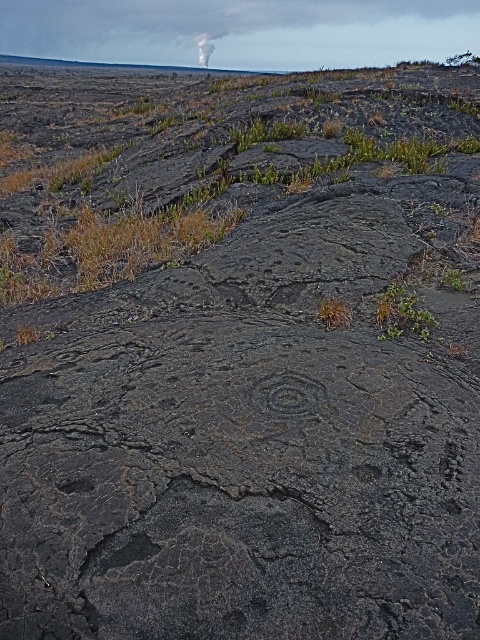
You are a botanist studying the lava field. You notice the green leafy plant at center and the white smoke at upper center. Which object is positioned to the right of the other?

The green leafy plant at center is to the right of the white smoke at upper center.

You are a botanist studying plant growth in volcanic areas. You observe the point marked at coordinates (x=402, y=314) in the image. What is the significance of this point in relation to the volcanic landscape?

The point at coordinates (x=402, y=314) indicates a green leafy plant at center, which shows that vegetation can thrive in harsh volcanic environments despite the rugged terrain and cracked lava fields.

Consider the image. You are a geologist studying the volcanic terrain. You need to locate the black textured rock at center. What are its coordinates?

The black textured rock at center is located at coordinates point (288, 394).